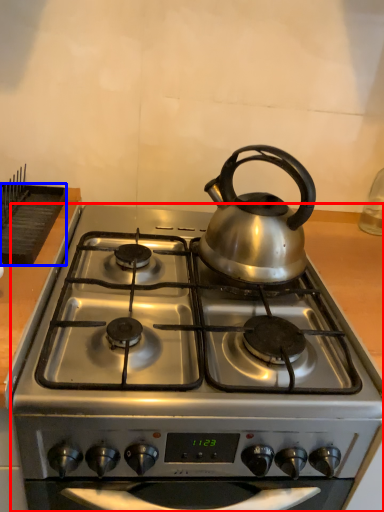
Question: Among these objects, which one is farthest to the camera, gas stove (highlighted by a red box) or kitchen appliance (highlighted by a blue box)?

Choices:
 (A) gas stove
 (B) kitchen appliance

Answer: (B)